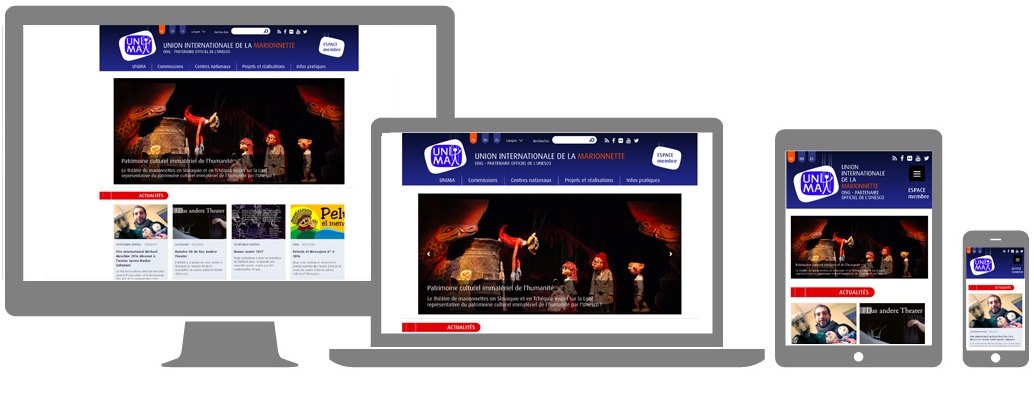
Image resolution: width=1034 pixels, height=403 pixels. In order to click on laptop in this screenshot , I will do `click(699, 349)`.